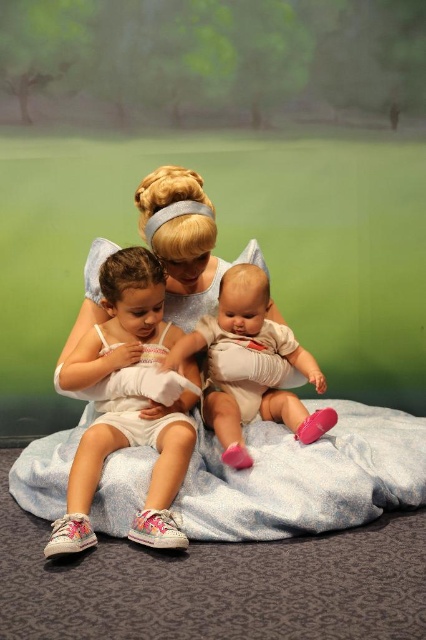
Question: Which point is closer to the camera?

Choices:
 (A) white cotton baby at center
 (B) white soft blanket at center

Answer: (B)

Question: Is white fabric dress at center positioned at the back of white cotton baby at center?

Choices:
 (A) no
 (B) yes

Answer: (A)

Question: Is white fabric dress at center wider than white cotton baby at center?

Choices:
 (A) no
 (B) yes

Answer: (A)

Question: Among these points, which one is nearest to the camera?

Choices:
 (A) (278, 349)
 (B) (160, 298)
 (C) (210, 520)

Answer: (C)

Question: Among these points, which one is farthest from the camera?

Choices:
 (A) (247, 488)
 (B) (262, 317)
 (C) (161, 524)

Answer: (B)

Question: Can you confirm if white soft blanket at center is positioned above white cotton baby at center?

Choices:
 (A) no
 (B) yes

Answer: (A)